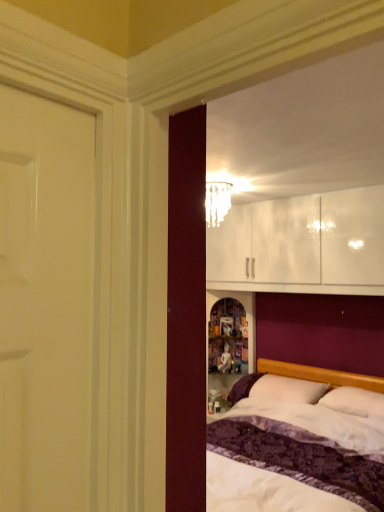
Question: In terms of size, does white soft pillow at lower right, the second pillow in the right-to-left sequence, appear bigger or smaller than white soft pillow at center, arranged as the second pillow when viewed from the left?

Choices:
 (A) small
 (B) big

Answer: (B)

Question: From the image's perspective, relative to white soft pillow at center, arranged as the second pillow when viewed from the left, is white soft pillow at lower right, the first pillow when ordered from left to right, above or below?

Choices:
 (A) below
 (B) above

Answer: (A)

Question: Estimate the real-world distances between objects in this image. Which object is closer to the white soft pillow at center, which ranks as the first pillow in right-to-left order?

Choices:
 (A) translucent glass chandelier at upper center
 (B) white soft pillow at lower right, the second pillow in the right-to-left sequence

Answer: (B)

Question: Which object is the closest to the translucent glass chandelier at upper center?

Choices:
 (A) white soft pillow at lower right, the second pillow in the right-to-left sequence
 (B) white soft pillow at center, arranged as the second pillow when viewed from the left

Answer: (A)